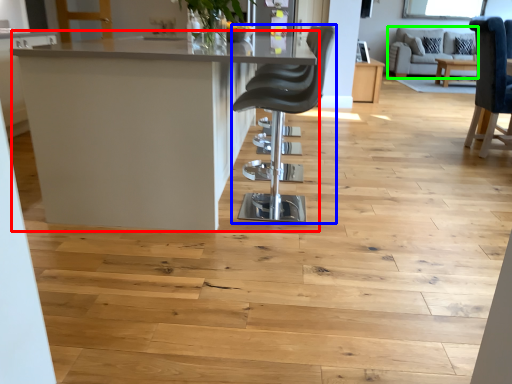
Question: Based on their relative distances, which object is farther from table (highlighted by a red box)? Choose from chair (highlighted by a blue box) and couch (highlighted by a green box).

Choices:
 (A) chair
 (B) couch

Answer: (B)